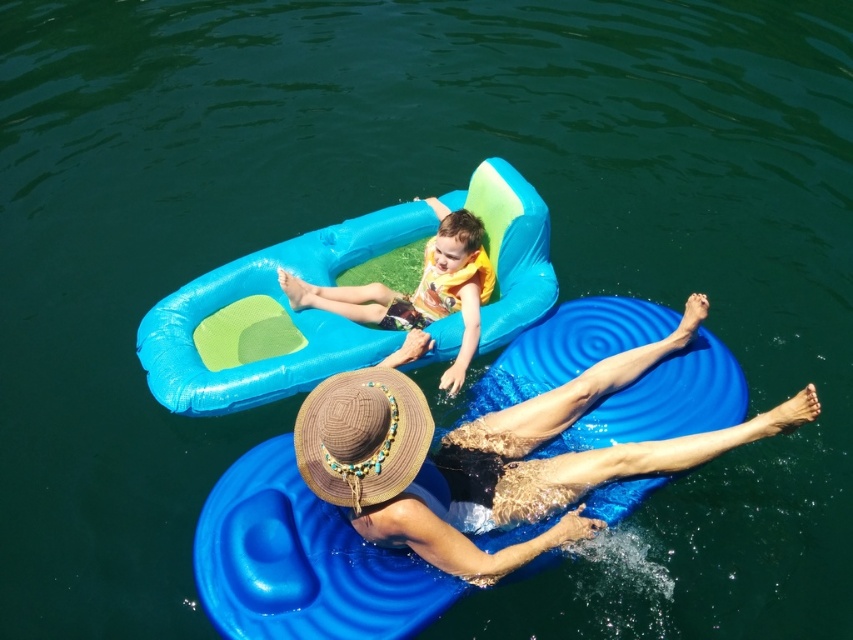
You are standing at the edge of the water and want to place a small buoy at the exact center of the straw hat at lower center. What coordinates should you aim for?

The coordinates for the exact center of the straw hat at lower center are point (495, 456).

You are a lifeguard observing the scene from a tower. You notice the blue inflatable boat at upper center and the matte yellow life vest at center. Which object is positioned higher in the image?

The blue inflatable boat at upper center is positioned higher than the matte yellow life vest at center in the image.

You are a photographer trying to capture a photo of the blue inflatable boat at upper center and the matte yellow life vest at center. Which object should you focus on first if you want to include both in your frame without moving the camera?

The blue inflatable boat at upper center is to the left of the matte yellow life vest at center, so you should focus on the blue inflatable boat at upper center first to ensure both are in the frame.